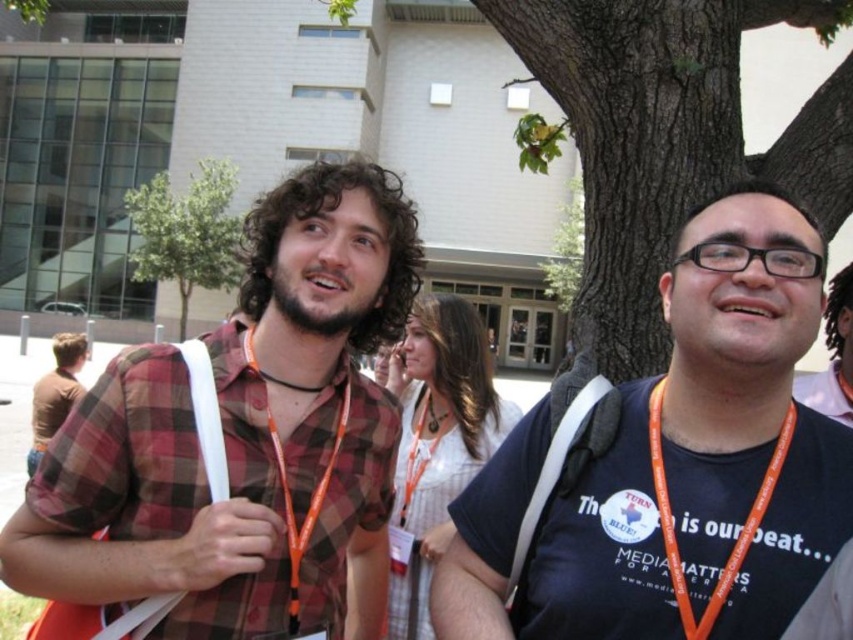
Question: Is black cord at center wider than brown leather jacket at left?

Choices:
 (A) no
 (B) yes

Answer: (A)

Question: Which is farther from the brown leather jacket at left?

Choices:
 (A) black cord at center
 (B) matte black shirt at center
 (C) plaid cotton shirt at center
 (D) brown rough bark tree at upper center

Answer: (B)

Question: Which is nearer to the brown leather jacket at left?

Choices:
 (A) white cotton shirt at center
 (B) black cord at center

Answer: (A)

Question: Among these objects, which one is farthest from the camera?

Choices:
 (A) white cotton shirt at center
 (B) black cord at center

Answer: (A)

Question: Observing the image, what is the correct spatial positioning of orange lanyard at center in reference to matte black shirt at center?

Choices:
 (A) below
 (B) above

Answer: (B)

Question: Does orange lanyard at center appear on the left side of black cord at center?

Choices:
 (A) yes
 (B) no

Answer: (B)